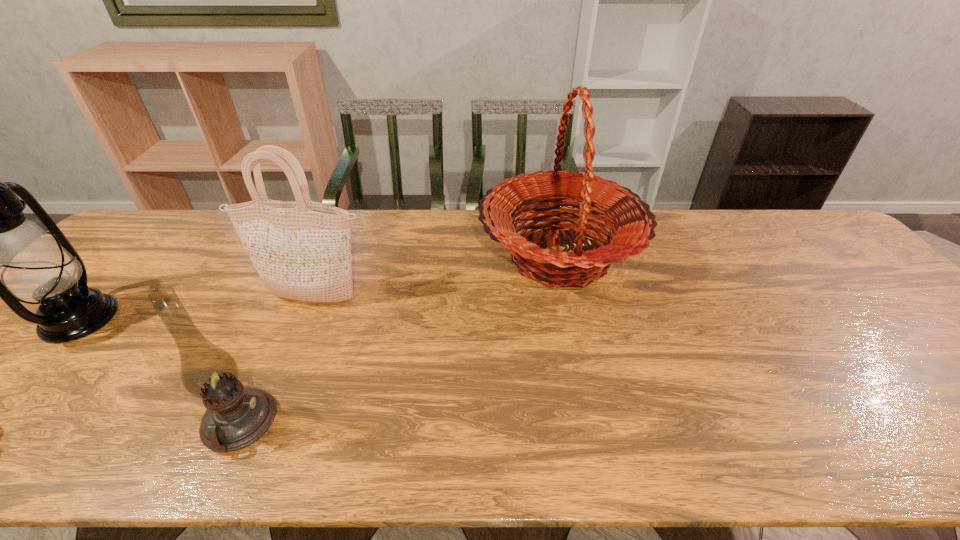
You are a GUI agent. You are given a task and a screenshot of the screen. Output one action in this format:
    pyautogui.click(x=<x>, y=<y>)
    Task: Click on the vacant area between the farther oil lamp and the nearest object
    
    Given the screenshot: What is the action you would take?
    pyautogui.click(x=159, y=370)

Where is `free space between the nearest object and the shopping bag`? This screenshot has width=960, height=540. free space between the nearest object and the shopping bag is located at coordinates (277, 361).

Locate an element on the screen. The width and height of the screenshot is (960, 540). empty space that is in between the shopping bag and the basket is located at coordinates (437, 278).

Locate which object ranks third in proximity to the basket. Please provide its 2D coordinates. Your answer should be formatted as a tuple, i.e. [(x, y)], where the tuple contains the x and y coordinates of a point satisfying the conditions above.

[(0, 243)]

Select which object is the closest to the rightmost object. Please provide its 2D coordinates. Your answer should be formatted as a tuple, i.e. [(x, y)], where the tuple contains the x and y coordinates of a point satisfying the conditions above.

[(301, 249)]

Locate an element on the screen. The height and width of the screenshot is (540, 960). vacant position in the image that satisfies the following two spatial constraints: 1. on the back side of the shopping bag; 2. on the left side of the left oil lamp is located at coordinates (98, 299).

This screenshot has height=540, width=960. In order to click on free space that satisfies the following two spatial constraints: 1. on the back side of the shopping bag; 2. on the right side of the basket in this screenshot , I will do `click(332, 256)`.

Locate an element on the screen. The width and height of the screenshot is (960, 540). free space that satisfies the following two spatial constraints: 1. on the back side of the shopping bag; 2. on the left side of the rightmost object is located at coordinates (332, 256).

Identify the location of free spot that satisfies the following two spatial constraints: 1. on the back side of the left oil lamp; 2. on the right side of the basket. The width and height of the screenshot is (960, 540). (137, 256).